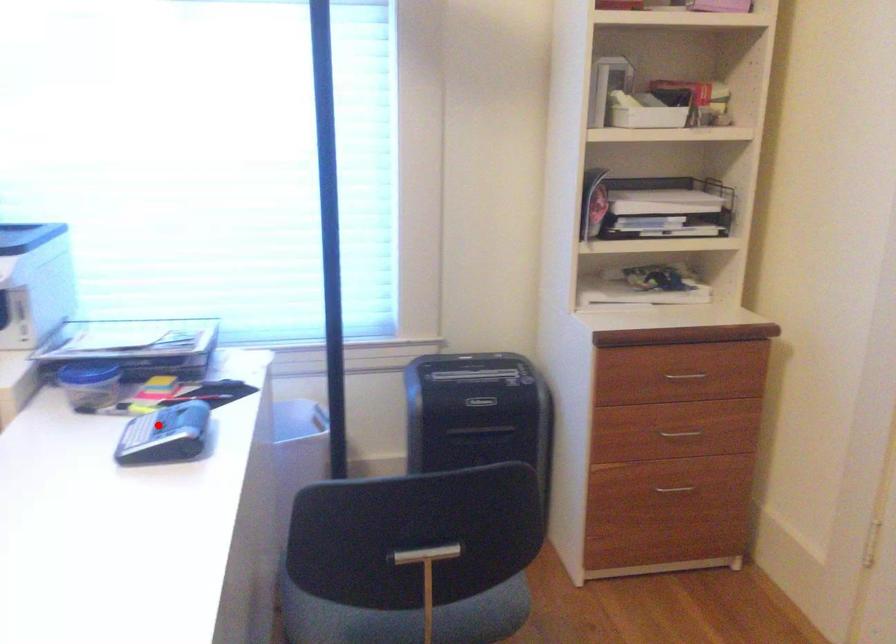
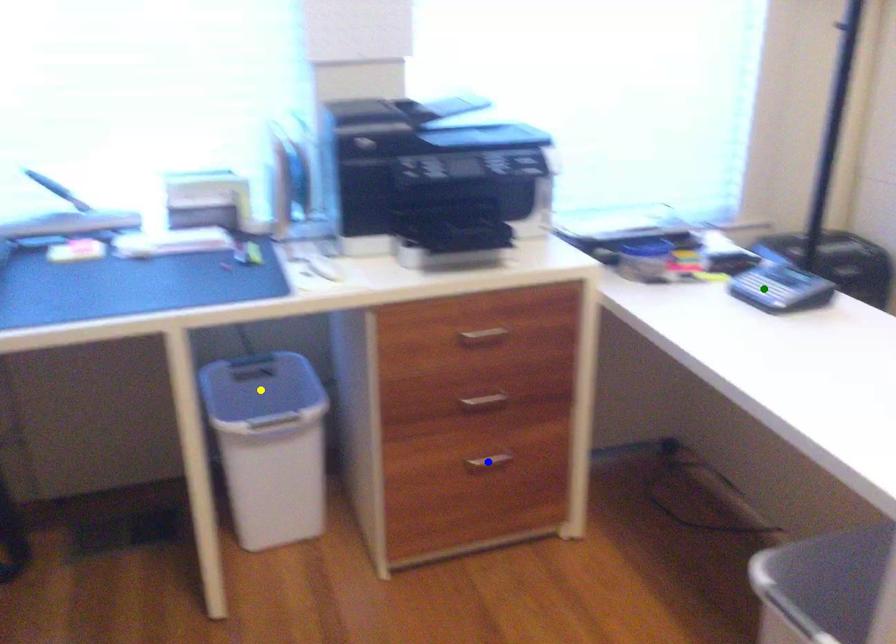
Question: I am providing you with two images of the same scene from different viewpoints. A red point is marked on the first image. You are given multiple points on the second image. In image 2, which mark is for the same physical point as the one in image 1?

Choices:
 (A) blue point
 (B) green point
 (C) yellow point

Answer: (B)